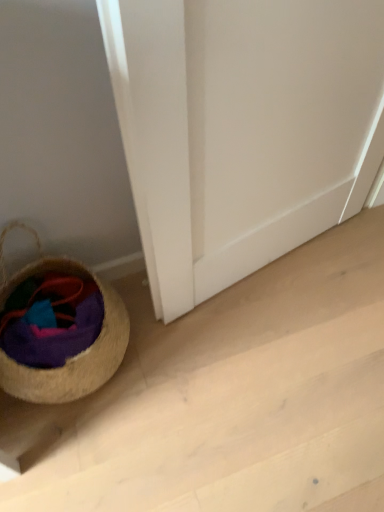
The width and height of the screenshot is (384, 512). Identify the location of free space in front of beige woven basket at lower left. (86, 457).